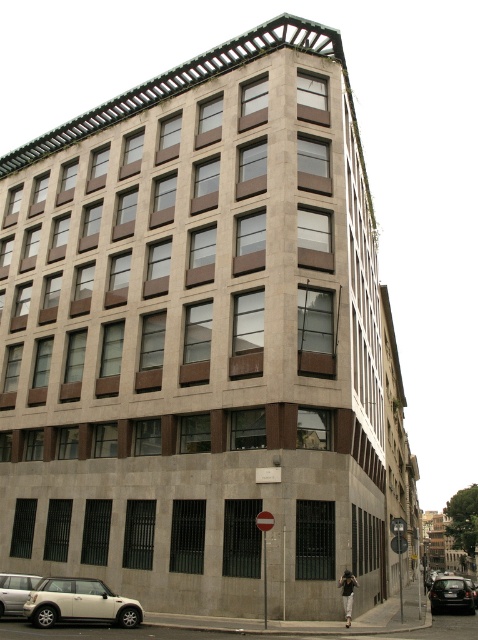
Can you confirm if metallic reflective sign at lower center is thinner than dark gray pants at lower right?

Yes.

In the scene shown: Is metallic reflective sign at lower center to the left of dark gray pants at lower right from the viewer's perspective?

Correct, you'll find metallic reflective sign at lower center to the left of dark gray pants at lower right.

Which is in front, point (270, 529) or point (347, 586)?

Positioned in front is point (270, 529).

Locate an element on the screen. metallic reflective sign at lower center is located at coordinates (264, 550).

In order to click on white matte car at lower left in this screenshot , I will do `click(78, 602)`.

Who is more forward, (98,604) or (448,588)?

Point (98,604) is more forward.

Locate an element on the screen. This screenshot has width=478, height=640. white matte car at lower left is located at coordinates (78, 602).

Does point (17, 580) come behind point (354, 577)?

No.

Can you confirm if silver metallic car at lower left is bigger than dark gray pants at lower right?

Yes, silver metallic car at lower left is bigger than dark gray pants at lower right.

Between point (22, 602) and point (347, 570), which one is positioned in front?

Point (22, 602) is more forward.

Image resolution: width=478 pixels, height=640 pixels. Find the location of `silver metallic car at lower left`. silver metallic car at lower left is located at coordinates (14, 592).